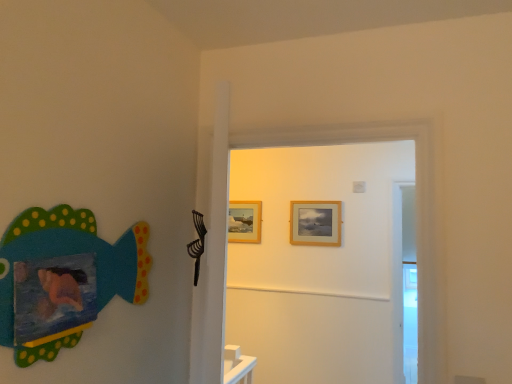
I want to click on wooden door at center, so click(417, 197).

Where is `matte painted fish at left`? matte painted fish at left is located at coordinates (51, 226).

This screenshot has width=512, height=384. What are the coordinates of `wooden door at center` in the screenshot? It's located at (417, 197).

Is wooden door at center directly adjacent to matte painted fish at left?

wooden door at center and matte painted fish at left are not in contact.

From the image's perspective, is wooden door at center located above matte painted fish at left?

No, from the image's perspective, wooden door at center is not above matte painted fish at left.

Consider the image. From a real-world perspective, is wooden door at center above or below matte painted fish at left?

From a real-world perspective, wooden door at center is physically above matte painted fish at left.

Between wooden door at center and matte painted fish at left, which one has smaller width?

Thinner between the two is matte painted fish at left.

Can you confirm if wooden picture frame at center, acting as the 2th picture frame starting from the right, is bigger than wooden door at center?

No, wooden picture frame at center, acting as the 2th picture frame starting from the right, is not bigger than wooden door at center.

Does wooden picture frame at center, acting as the 2th picture frame starting from the right, appear on the right side of wooden door at center?

In fact, wooden picture frame at center, acting as the 2th picture frame starting from the right, is to the left of wooden door at center.

Are wooden picture frame at center, acting as the 2th picture frame starting from the right, and wooden door at center far apart?

Absolutely, wooden picture frame at center, acting as the 2th picture frame starting from the right, is distant from wooden door at center.

Is wooden picture frame at center, the second picture frame in the front-to-back sequence, in front of or behind wooden door at center in the image?

wooden picture frame at center, the second picture frame in the front-to-back sequence, is positioned farther from the viewer than wooden door at center.

Is wooden picture frame at upper center, which is the first picture frame from right to left, completely or partially inside matte painted fish at left?

No.

Find the location of a particular element. fish on the left of wooden picture frame at upper center, which is the second picture frame in back-to-front order is located at coordinates (51, 226).

How far apart are matte painted fish at left and wooden picture frame at upper center, which is the first picture frame from right to left?

matte painted fish at left is 2.25 meters away from wooden picture frame at upper center, which is the first picture frame from right to left.

Which point is more forward, [45,233] or [333,233]?

The point [45,233] is closer.

Considering the positions of objects wooden picture frame at upper center, the second picture frame from the left, and matte painted fish at left in the image provided, who is more to the left, wooden picture frame at upper center, the second picture frame from the left, or matte painted fish at left?

From the viewer's perspective, matte painted fish at left appears more on the left side.

Measure the distance between wooden picture frame at upper center, which is the first picture frame from right to left, and matte painted fish at left.

They are 7.39 feet apart.

From a real-world perspective, is wooden picture frame at upper center, placed as the 1th picture frame when sorted from front to back, under matte painted fish at left?

Incorrect, from a real-world perspective, wooden picture frame at upper center, placed as the 1th picture frame when sorted from front to back, is higher than matte painted fish at left.

Which object is wider, wooden picture frame at upper center, which is the first picture frame from right to left, or matte painted fish at left?

matte painted fish at left.

Relative to wooden door at center, is matte painted fish at left in front or behind?

matte painted fish at left is positioned closer to the viewer than wooden door at center.

How far apart are matte painted fish at left and wooden door at center?

The distance of matte painted fish at left from wooden door at center is 30.75 inches.

From the image's perspective, between matte painted fish at left and wooden door at center, which one is located above?

matte painted fish at left is shown above in the image.

Which point is more forward, (55, 355) or (429, 376)?

Point (55, 355)

From a real-world perspective, is wooden picture frame at upper center, placed as the 1th picture frame when sorted from front to back, on wooden door at center?

Indeed, from a real-world perspective, wooden picture frame at upper center, placed as the 1th picture frame when sorted from front to back, stands above wooden door at center.

Based on the photo, could you tell me if wooden picture frame at upper center, the second picture frame from the left, is facing wooden door at center?

Yes, wooden picture frame at upper center, the second picture frame from the left, is turned towards wooden door at center.

Locate an element on the screen. This screenshot has width=512, height=384. door below the wooden picture frame at upper center, which is the first picture frame from right to left (from a real-world perspective) is located at coordinates (417, 197).

Visually, is wooden picture frame at upper center, placed as the 1th picture frame when sorted from front to back, positioned to the left or to the right of wooden picture frame at center, placed as the first picture frame when sorted from back to front?

Based on their positions, wooden picture frame at upper center, placed as the 1th picture frame when sorted from front to back, is located to the right of wooden picture frame at center, placed as the first picture frame when sorted from back to front.

Locate an element on the screen. picture frame on the left of the wooden picture frame at upper center, which is the first picture frame from right to left is located at coordinates (244, 221).

Who is bigger, wooden picture frame at upper center, which is the second picture frame in back-to-front order, or wooden picture frame at center, the second picture frame in the front-to-back sequence?

Bigger between the two is wooden picture frame at upper center, which is the second picture frame in back-to-front order.

Is wooden picture frame at upper center, placed as the 1th picture frame when sorted from front to back, oriented away from wooden picture frame at center, the second picture frame in the front-to-back sequence?

No, wooden picture frame at upper center, placed as the 1th picture frame when sorted from front to back, is not facing away from wooden picture frame at center, the second picture frame in the front-to-back sequence.

You are a GUI agent. You are given a task and a screenshot of the screen. Output one action in this format:
    pyautogui.click(x=<x>, y=<y>)
    Task: Click on the fish in front of the wooden door at center
    Image resolution: width=512 pixels, height=384 pixels.
    Given the screenshot: What is the action you would take?
    pyautogui.click(x=51, y=226)

Identify the location of door located on the right of wooden picture frame at center, acting as the 2th picture frame starting from the right. (417, 197).

Considering their positions, is wooden door at center positioned closer to matte painted fish at left than wooden picture frame at upper center, which is the first picture frame from right to left?

Based on the image, wooden door at center appears to be nearer to matte painted fish at left.

Based on their spatial positions, is wooden door at center or matte painted fish at left further from wooden picture frame at upper center, which is the second picture frame in back-to-front order?

matte painted fish at left is positioned further to the anchor wooden picture frame at upper center, which is the second picture frame in back-to-front order.

Considering their positions, is wooden door at center positioned closer to wooden picture frame at upper center, which is the first picture frame from right to left, than wooden picture frame at center, acting as the 2th picture frame starting from the right?

wooden picture frame at center, acting as the 2th picture frame starting from the right, is closer to wooden picture frame at upper center, which is the first picture frame from right to left.

Which object lies nearer to the anchor point matte painted fish at left, wooden picture frame at upper center, which is the first picture frame from right to left, or wooden door at center?

wooden door at center is positioned closer to the anchor matte painted fish at left.

From the picture: From the image, which object appears to be farther from wooden door at center, wooden picture frame at upper center, which is the second picture frame in back-to-front order, or wooden picture frame at center, placed as the first picture frame when sorted from back to front?

The object further to wooden door at center is wooden picture frame at center, placed as the first picture frame when sorted from back to front.

Based on the photo, considering their positions, is wooden picture frame at upper center, which is the first picture frame from right to left, positioned closer to wooden picture frame at center, the second picture frame in the front-to-back sequence, than matte painted fish at left?

wooden picture frame at upper center, which is the first picture frame from right to left.

Looking at the image, which one is located further to wooden door at center, matte painted fish at left or wooden picture frame at center, the second picture frame in the front-to-back sequence?

wooden picture frame at center, the second picture frame in the front-to-back sequence.

Which object lies further to the anchor point wooden picture frame at upper center, placed as the 1th picture frame when sorted from front to back, wooden picture frame at center, placed as the first picture frame when sorted from back to front, or wooden door at center?

The object further to wooden picture frame at upper center, placed as the 1th picture frame when sorted from front to back, is wooden door at center.

Image resolution: width=512 pixels, height=384 pixels. What are the coordinates of `picture frame located between matte painted fish at left and wooden picture frame at center, the second picture frame in the front-to-back sequence, in the depth direction` in the screenshot? It's located at (315, 223).

Identify the location of picture frame between wooden door at center and wooden picture frame at center, placed as the first picture frame when sorted from back to front, along the z-axis. (315, 223).

In order to click on door positioned between matte painted fish at left and wooden picture frame at upper center, which is the first picture frame from right to left, from near to far in this screenshot , I will do `click(417, 197)`.

Where is `door between matte painted fish at left and wooden picture frame at center, acting as the 2th picture frame starting from the right, from front to back`? Image resolution: width=512 pixels, height=384 pixels. door between matte painted fish at left and wooden picture frame at center, acting as the 2th picture frame starting from the right, from front to back is located at coordinates (417, 197).